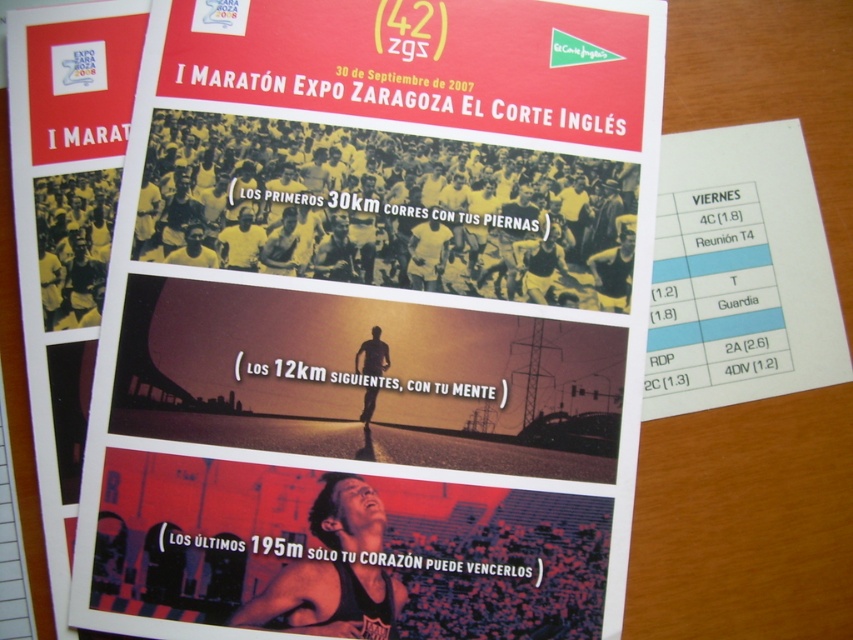
Consider the image. You are designing a poster and need to ensure that the matte black runner at lower center and the white paper at upper right are visible. Given their sizes, which object should you adjust to make sure both are clearly seen?

The white paper at upper right is smaller than the matte black runner at lower center. To ensure both are clearly visible, you should enlarge the white paper at upper right or reduce the size of the matte black runner at lower center.

You are looking at the promotional flyer for the marathon. There is a matte black runner at lower center and a white paper at upper right. Which object is closer to you?

The matte black runner at lower center is closer to you because it is in front of the white paper at upper right.